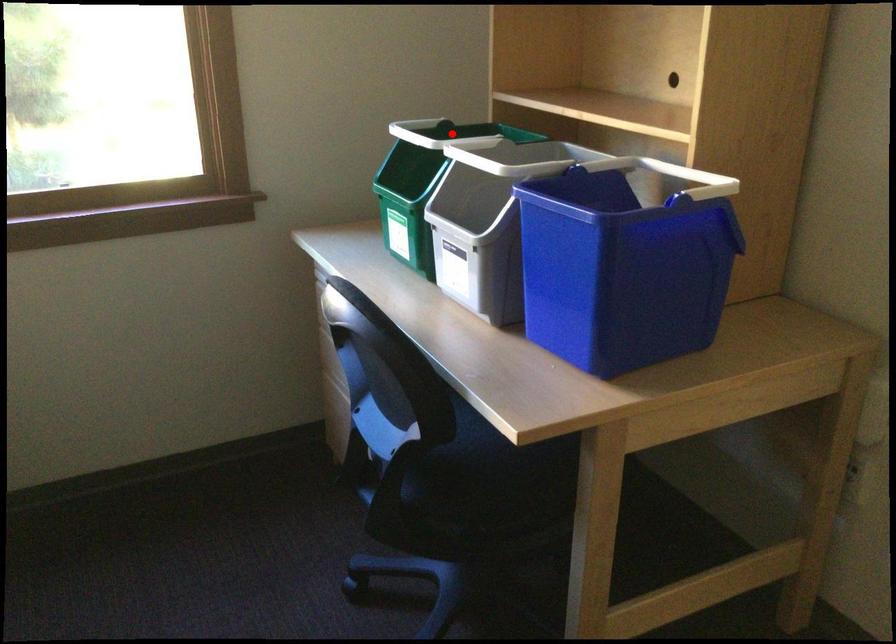
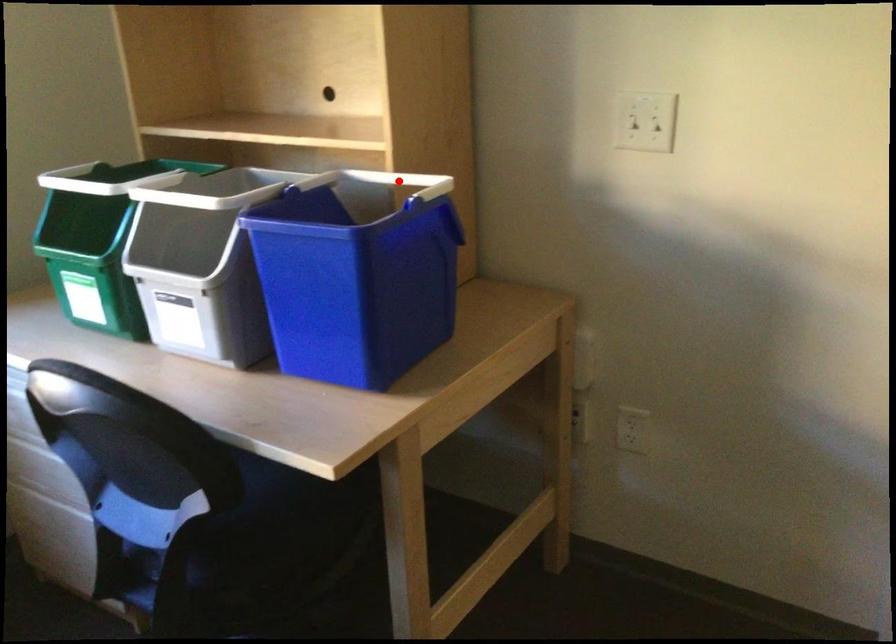
I am providing you with two images of the same scene from different viewpoints. A red point is marked on the first image and another point is marked on the second image. Does the point marked in image1 correspond to the same location as the one in image2?

No